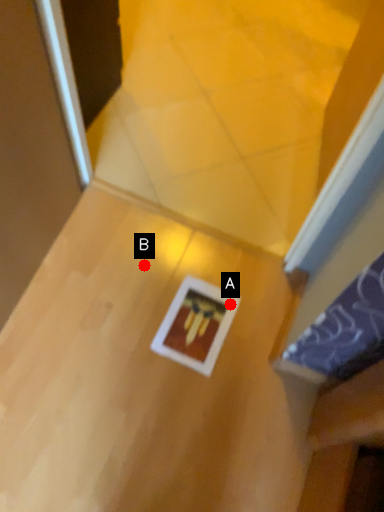
Question: Two points are circled on the image, labeled by A and B beside each circle. Which point is closer to the camera taking this photo?

Choices:
 (A) A is closer
 (B) B is closer

Answer: (A)